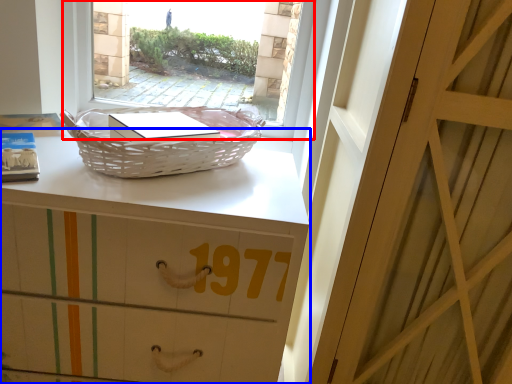
Question: Which of the following is the closest to the observer, window (highlighted by a red box) or desk (highlighted by a blue box)?

Choices:
 (A) window
 (B) desk

Answer: (B)